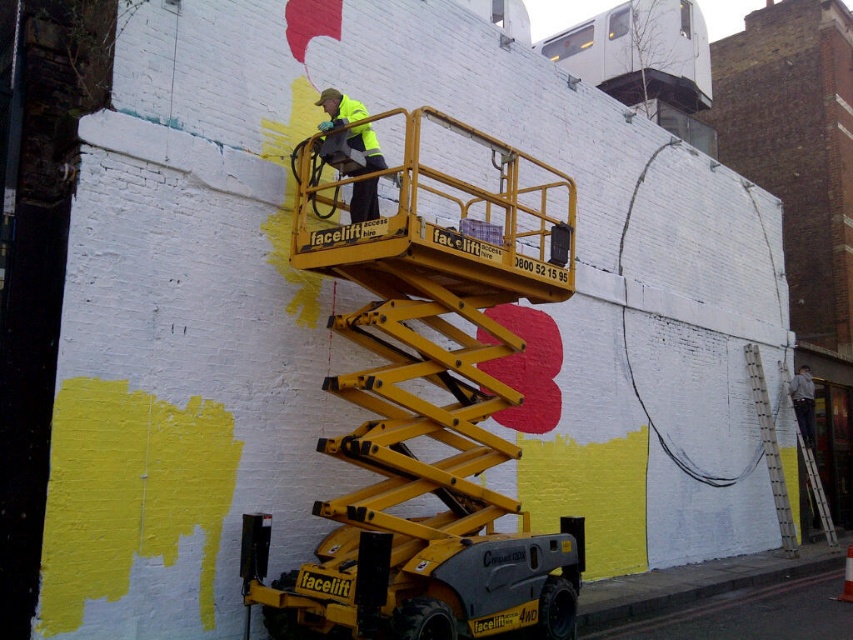
You are a safety inspector checking the painting site. You notice the yellow metallic scissor lift at center and the white plastic ladder at right. According to safety regulations, elevated work platforms must not be positioned above other workers. Is the current setup compliant with safety standards?

The yellow metallic scissor lift at center is located above the white plastic ladder at right, which means it violates safety regulations since elevated platforms cannot be positioned above other workers. The setup is noncompliant.

You are a pedestrian walking along the street and want to take a photo of the high visibility yellow jacket at center and the white plastic ladder at right. Which object will appear larger in your photo?

The high visibility yellow jacket at center will appear larger in the photo because it is closer to the viewer than the white plastic ladder at right.